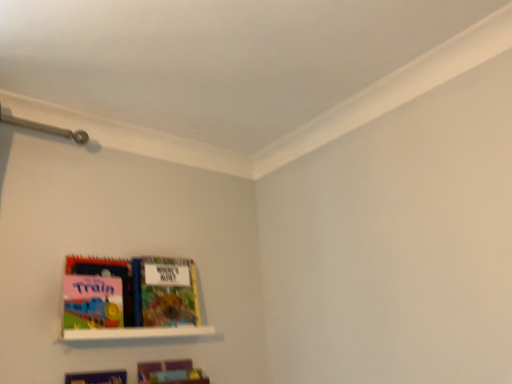
Question: Is white glossy shelf at lower left turned away from multicolored paper book at center, marked as the second book in a bottom-to-top arrangement?

Choices:
 (A) no
 (B) yes

Answer: (A)

Question: Can you confirm if white glossy shelf at lower left is positioned to the right of multicolored paper book at center, marked as the second book in a bottom-to-top arrangement?

Choices:
 (A) yes
 (B) no

Answer: (B)

Question: From the image's perspective, is white glossy shelf at lower left beneath multicolored paper book at center, marked as the second book in a bottom-to-top arrangement?

Choices:
 (A) no
 (B) yes

Answer: (B)

Question: Could multicolored paper book at center, which appears as the first book when viewed from the top, be considered to be inside white glossy shelf at lower left?

Choices:
 (A) no
 (B) yes

Answer: (A)

Question: From the image's perspective, is white glossy shelf at lower left on top of multicolored paper book at center, which appears as the first book when viewed from the top?

Choices:
 (A) yes
 (B) no

Answer: (B)

Question: From a real-world perspective, is white glossy shelf at lower left located higher than multicolored paper book at center, marked as the second book in a bottom-to-top arrangement?

Choices:
 (A) no
 (B) yes

Answer: (A)

Question: Can you confirm if matte plastic book at lower left, placed as the 2th book when sorted from top to bottom, is wider than white glossy shelf at lower left?

Choices:
 (A) yes
 (B) no

Answer: (B)

Question: From a real-world perspective, is matte plastic book at lower left, marked as the 1th book in a bottom-to-top arrangement, under white glossy shelf at lower left?

Choices:
 (A) no
 (B) yes

Answer: (B)

Question: From the image's perspective, is matte plastic book at lower left, marked as the 1th book in a bottom-to-top arrangement, above white glossy shelf at lower left?

Choices:
 (A) no
 (B) yes

Answer: (A)

Question: Does matte plastic book at lower left, placed as the 2th book when sorted from top to bottom, have a smaller size compared to white glossy shelf at lower left?

Choices:
 (A) no
 (B) yes

Answer: (B)

Question: Can you confirm if matte plastic book at lower left, placed as the 2th book when sorted from top to bottom, is bigger than white glossy shelf at lower left?

Choices:
 (A) yes
 (B) no

Answer: (B)

Question: Considering the relative sizes of matte plastic book at lower left, marked as the 1th book in a bottom-to-top arrangement, and white glossy shelf at lower left in the image provided, is matte plastic book at lower left, marked as the 1th book in a bottom-to-top arrangement, taller than white glossy shelf at lower left?

Choices:
 (A) no
 (B) yes

Answer: (B)

Question: From the image's perspective, would you say white glossy shelf at lower left is positioned over matte plastic book at lower left, marked as the 1th book in a bottom-to-top arrangement?

Choices:
 (A) no
 (B) yes

Answer: (B)